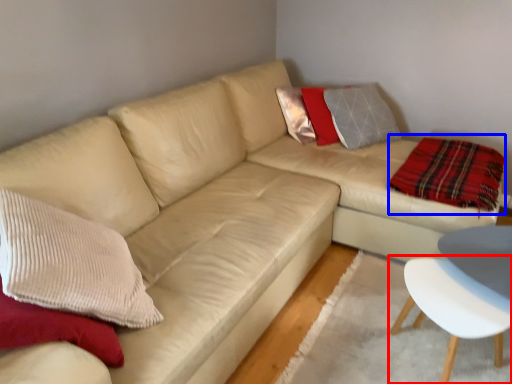
Question: Which object appears closest to the camera in this image, chair (highlighted by a red box) or plaid (highlighted by a blue box)?

Choices:
 (A) chair
 (B) plaid

Answer: (A)